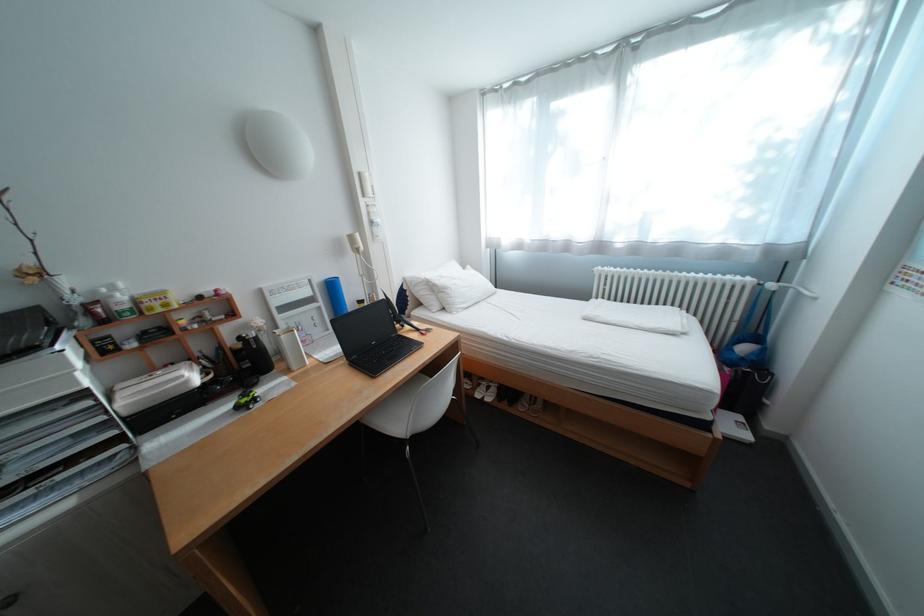
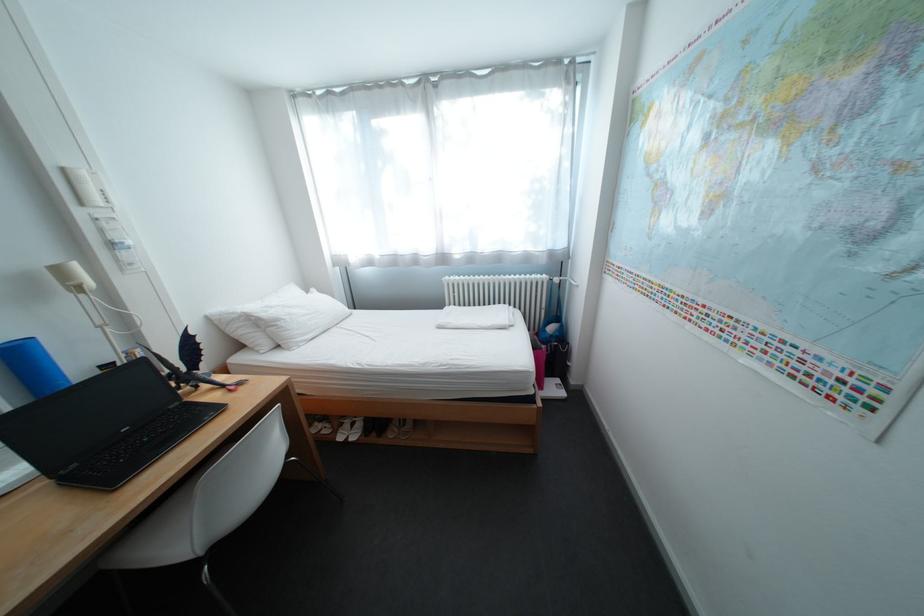
In the second image, find the point that corresponds to pixel 721 419 in the first image.

(544, 392)